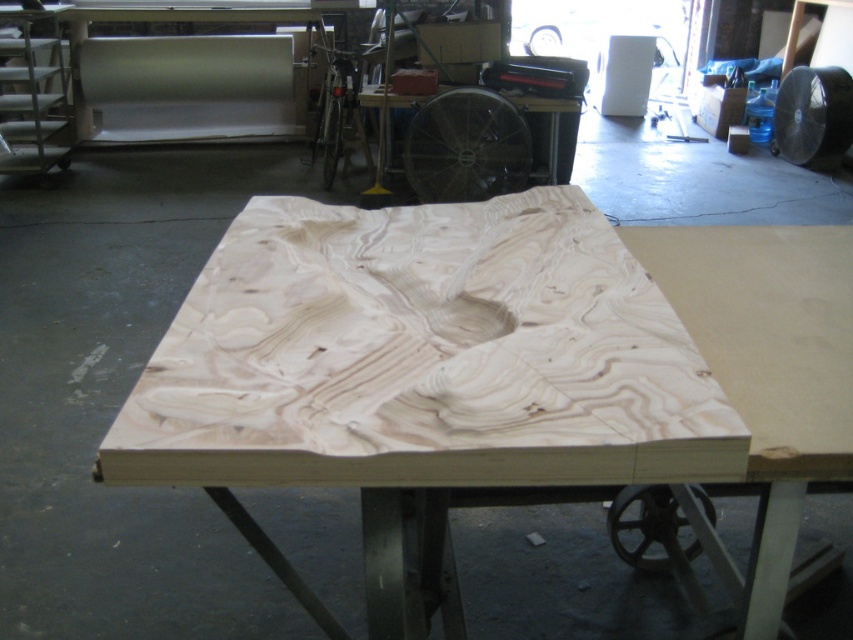
Can you confirm if natural wood plywood at center is taller than natural wood table at center?

No, natural wood plywood at center is not taller than natural wood table at center.

Which is more to the right, natural wood plywood at center or natural wood table at center?

Positioned to the right is natural wood table at center.

The image size is (853, 640). I want to click on natural wood plywood at center, so pyautogui.click(x=422, y=356).